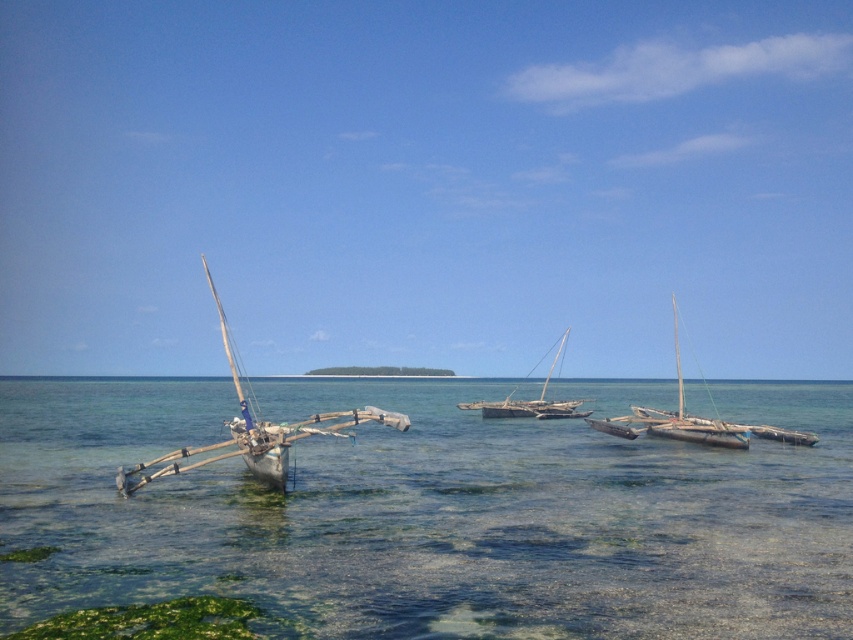
In the scene shown: Does wooden sailboat at left appear on the left side of wooden sailboat at center?

Indeed, wooden sailboat at left is positioned on the left side of wooden sailboat at center.

Does wooden sailboat at left have a smaller size compared to wooden sailboat at center?

No.

This screenshot has height=640, width=853. Find the location of `wooden sailboat at left`. wooden sailboat at left is located at coordinates (253, 429).

Which is in front, point (450, 616) or point (554, 364)?

Point (450, 616)

Based on the photo, is clear water at boat left smaller than wooden sailboat at center?

Incorrect, clear water at boat left is not smaller in size than wooden sailboat at center.

Which is behind, point (242, 512) or point (541, 394)?

Point (541, 394)

Locate an element on the screen. clear water at boat left is located at coordinates (430, 515).

Is clear water at boat left to the left of wooden sailboat at left from the viewer's perspective?

No, clear water at boat left is not to the left of wooden sailboat at left.

Which is more to the right, clear water at boat left or wooden sailboat at left?

clear water at boat left

Which is behind, point (712, 605) or point (273, 442)?

The point (273, 442) is more distant.

Find the location of a particular element. The image size is (853, 640). clear water at boat left is located at coordinates (430, 515).